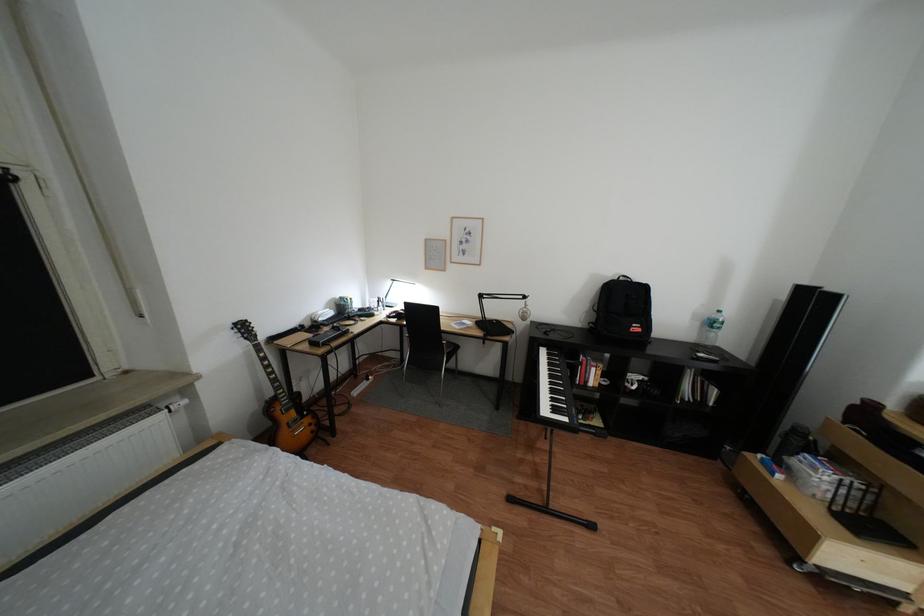
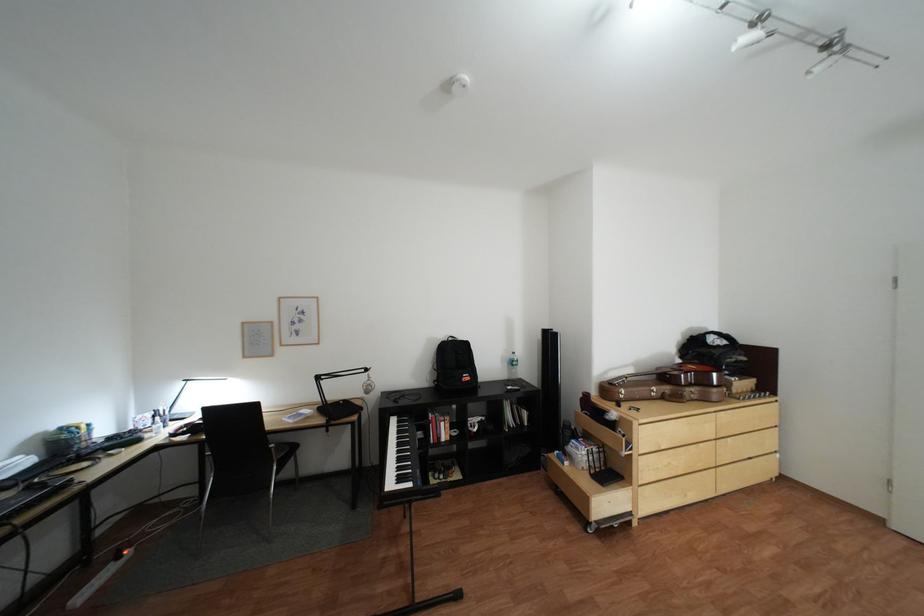
Question: I am providing you with two images of the same scene from different viewpoints. After the viewpoint changes to image2, which objects are now occluded?

Choices:
 (A) black bag
 (B) black backpack
 (C) clear water bottle
 (D) none of these

Answer: (D)